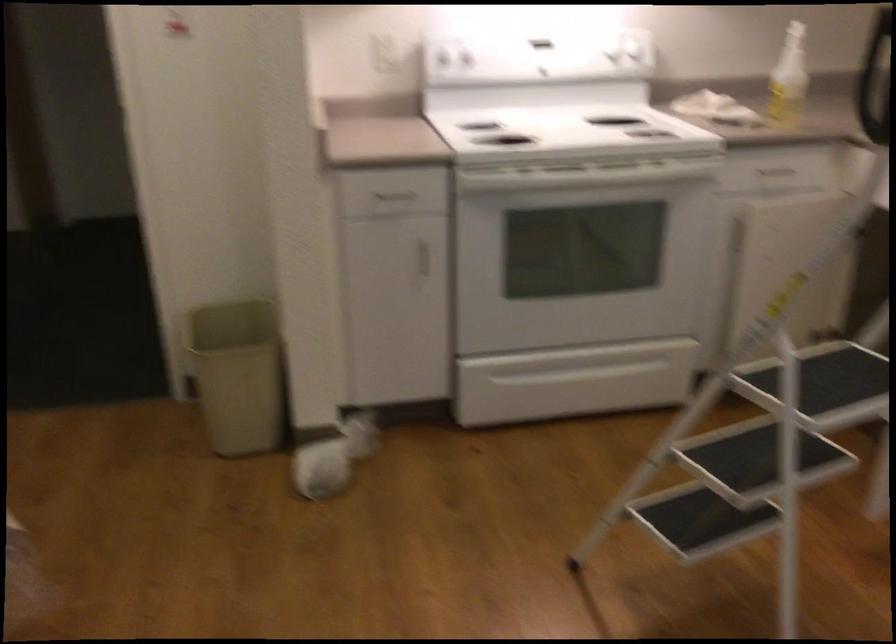
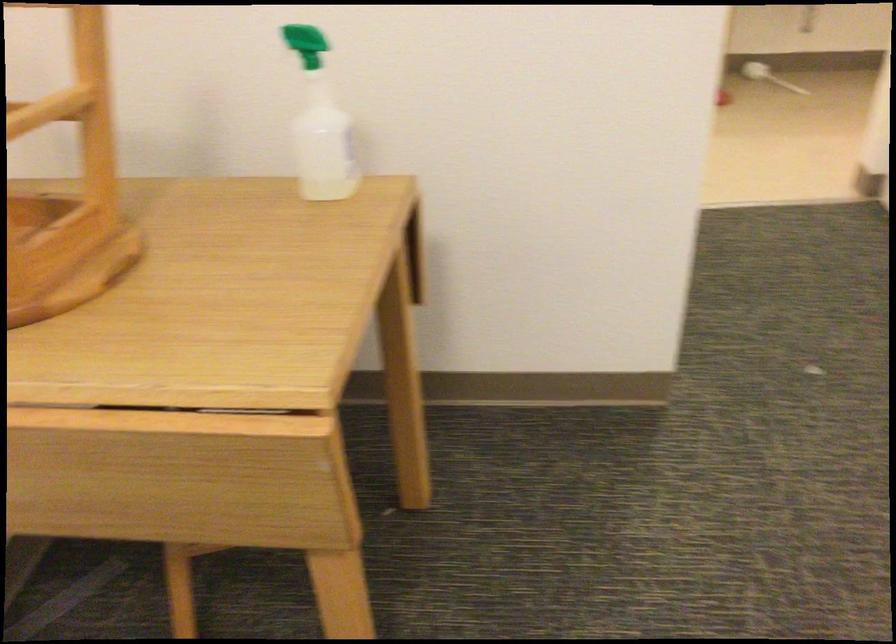
How did the camera likely rotate?

The camera's rotation is toward left-down.